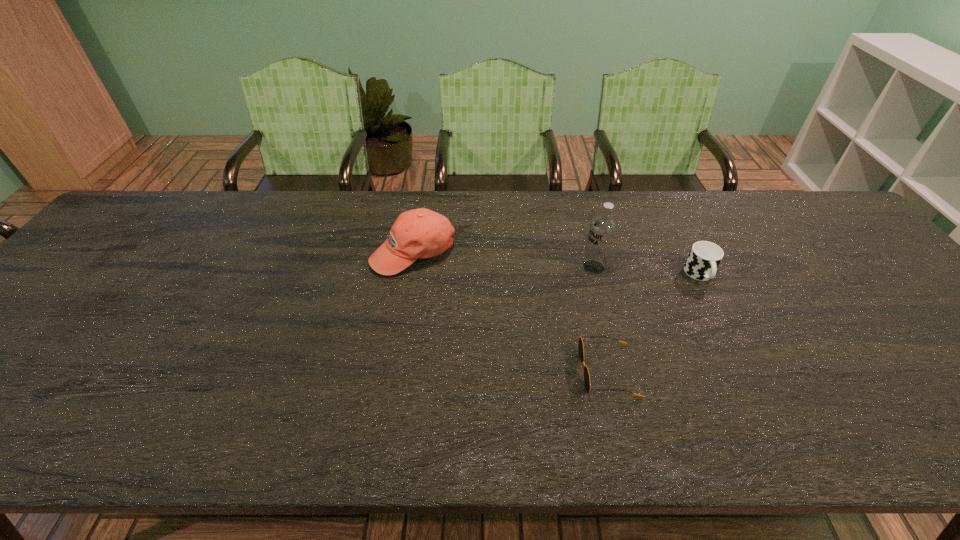
Find the location of a particular element. The width and height of the screenshot is (960, 540). free location located on the right of the third shortest object is located at coordinates (533, 252).

The image size is (960, 540). Find the location of `vacant region located on the side of the rightmost object with the handle`. vacant region located on the side of the rightmost object with the handle is located at coordinates (750, 375).

Image resolution: width=960 pixels, height=540 pixels. In order to click on vacant area situated 0.210m on the front-facing side of the sunglasses in this screenshot , I will do `click(485, 370)`.

Identify the location of vacant region located on the front-facing side of the sunglasses. (485, 370).

You are a GUI agent. You are given a task and a screenshot of the screen. Output one action in this format:
    pyautogui.click(x=<x>, y=<y>)
    Task: Click on the vacant space located on the front-facing side of the sunglasses
    The image size is (960, 540).
    Given the screenshot: What is the action you would take?
    pyautogui.click(x=489, y=370)

This screenshot has width=960, height=540. Identify the location of object that is at the far edge. (421, 233).

The width and height of the screenshot is (960, 540). Identify the location of free space at the far edge of the desktop. (459, 220).

In order to click on free space at the near edge in this screenshot , I will do (x=581, y=430).

Where is `free space at the left edge of the desktop`? free space at the left edge of the desktop is located at coordinates (6, 361).

This screenshot has height=540, width=960. In order to click on free spot between the tallest object and the third tallest object in this screenshot , I will do `click(647, 271)`.